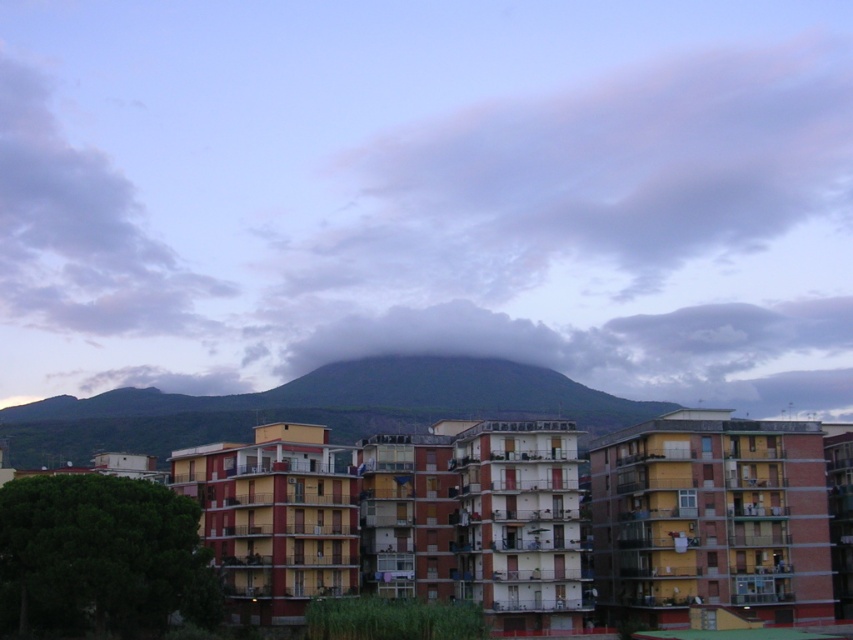
Question: Which point is farther to the camera?

Choices:
 (A) (103, 417)
 (B) (223, 365)

Answer: (B)

Question: Among these objects, which one is farthest from the camera?

Choices:
 (A) cloudy sky at center
 (B) dark green mountain at center

Answer: (A)

Question: Does cloudy sky at center have a smaller size compared to dark green mountain at center?

Choices:
 (A) yes
 (B) no

Answer: (B)

Question: Does cloudy sky at center appear on the right side of dark green mountain at center?

Choices:
 (A) no
 (B) yes

Answer: (A)

Question: Can you confirm if cloudy sky at center is smaller than dark green mountain at center?

Choices:
 (A) yes
 (B) no

Answer: (B)